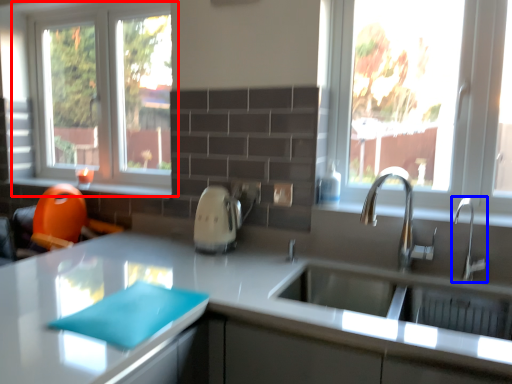
Question: Which object appears farthest to the camera in this image, window (highlighted by a red box) or tap (highlighted by a blue box)?

Choices:
 (A) window
 (B) tap

Answer: (A)